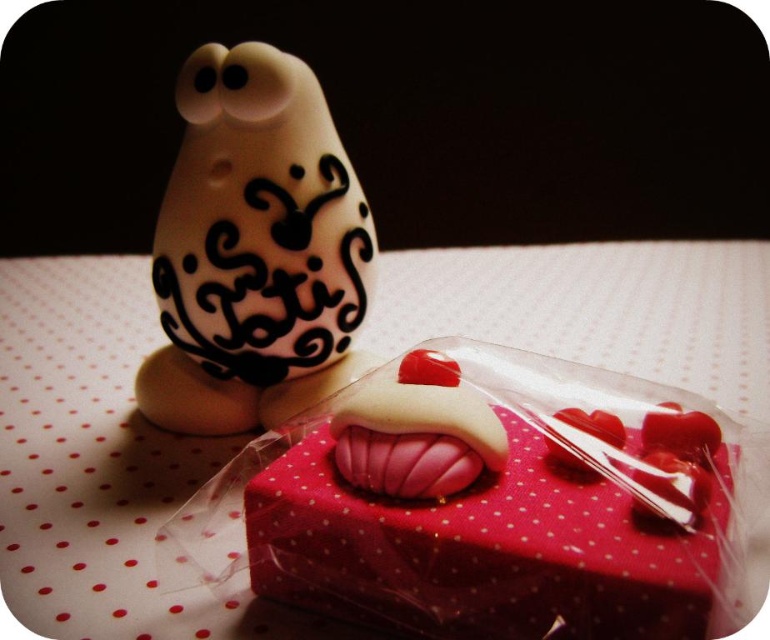
You are an interior designer arranging items on a shelf. You have a matte pink fabric box at center and a white glossy figurine at upper left. Based on the scene description, which object is located to the right of the other?

The matte pink fabric box at center is positioned on the right side of white glossy figurine at upper left.